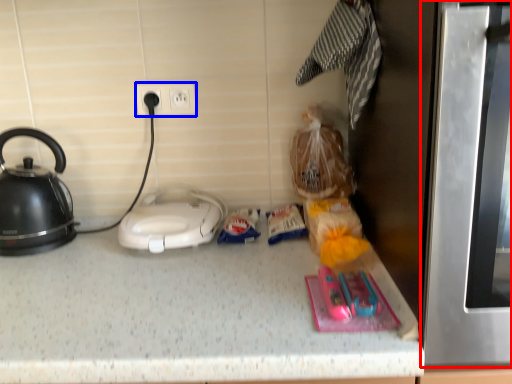
Question: Among these objects, which one is nearest to the camera, oven (highlighted by a red box) or electric outlet (highlighted by a blue box)?

Choices:
 (A) oven
 (B) electric outlet

Answer: (A)